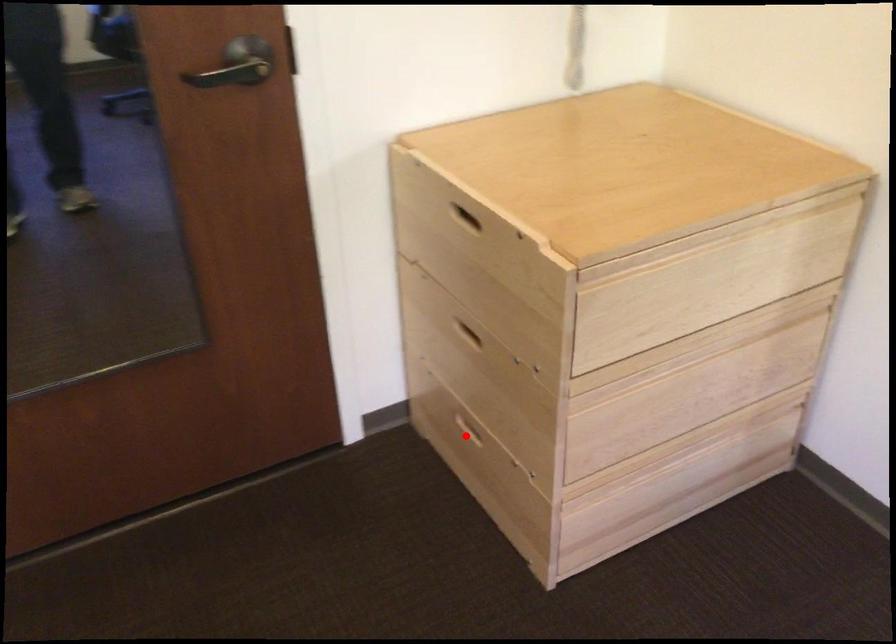
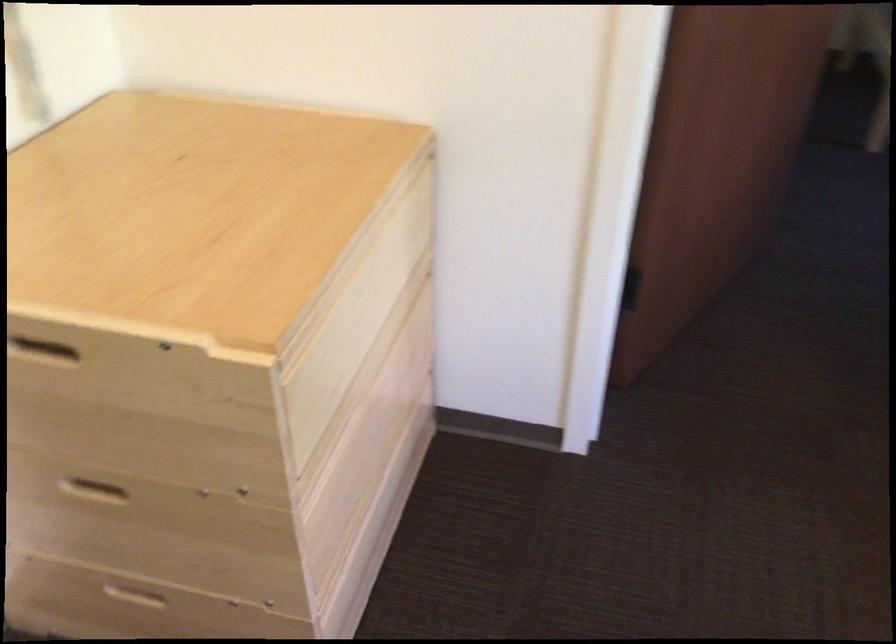
Question: A red point is marked in image1. In image2, is the corresponding 3D point closer to the camera or farther? Reply with the corresponding letter.

Choices:
 (A) The corresponding 3D point is closer.
 (B) The corresponding 3D point is farther.

Answer: (A)